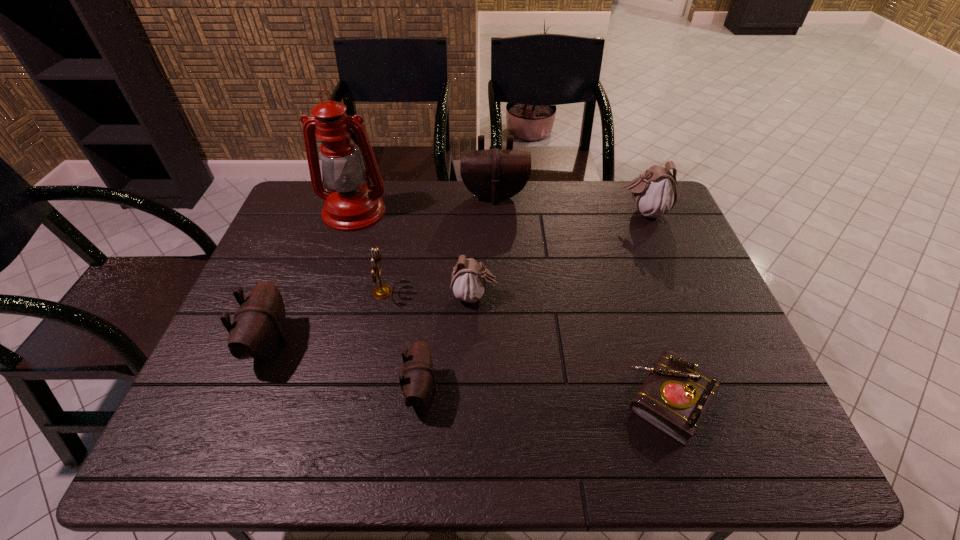
At what (x,y) coordinates should I click in order to perform the action: click on object that is at the far left corner. Please return your answer as a coordinate pair (x, y). The image size is (960, 540). Looking at the image, I should click on (351, 205).

Where is `object present at the far right corner`? The image size is (960, 540). object present at the far right corner is located at coordinates (655, 192).

At what (x,y) coordinates should I click in order to perform the action: click on object located in the near right corner section of the desktop. Please return your answer as a coordinate pair (x, y). This screenshot has height=540, width=960. Looking at the image, I should click on (674, 397).

Where is `free space at the far edge`? This screenshot has width=960, height=540. free space at the far edge is located at coordinates (540, 224).

What are the coordinates of `vacant region at the near edge of the desktop` in the screenshot? It's located at (478, 453).

This screenshot has height=540, width=960. I want to click on free space at the left edge of the desktop, so click(x=277, y=364).

Locate an element on the screen. free space at the far left corner of the desktop is located at coordinates (328, 187).

I want to click on unoccupied area between the leftmost pouch and the tallest object, so point(312,278).

Locate an element on the screen. vacant region between the second biggest brown pouch and the smallest brown pouch is located at coordinates (346, 368).

At what (x,y) coordinates should I click in order to perform the action: click on free space that is in between the biggest brown pouch and the leftmost pouch. Please return your answer as a coordinate pair (x, y). The width and height of the screenshot is (960, 540). Looking at the image, I should click on (382, 270).